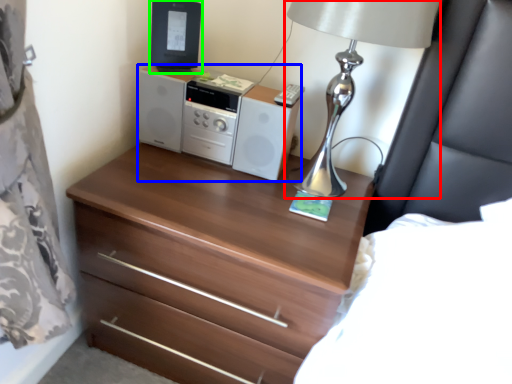
Question: Which is nearer to the table lamp (highlighted by a red box)? stereo (highlighted by a blue box) or desktop computer (highlighted by a green box).

Choices:
 (A) stereo
 (B) desktop computer

Answer: (A)